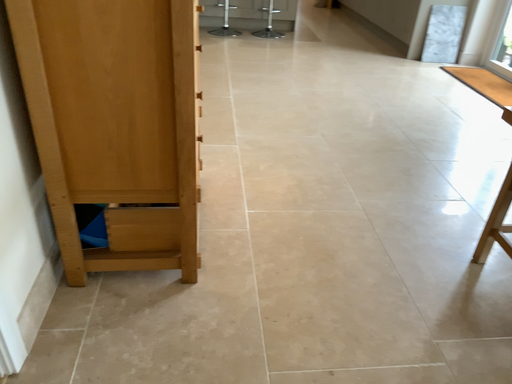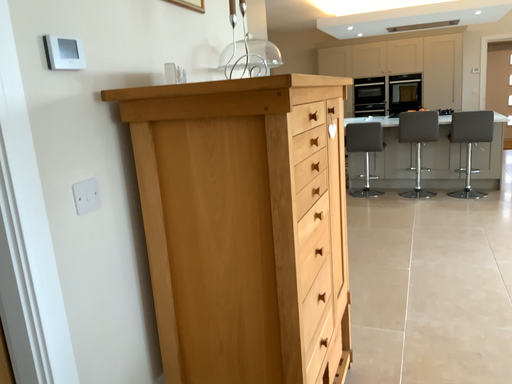
Question: Which way did the camera rotate in the video?

Choices:
 (A) rotated left
 (B) rotated right

Answer: (A)